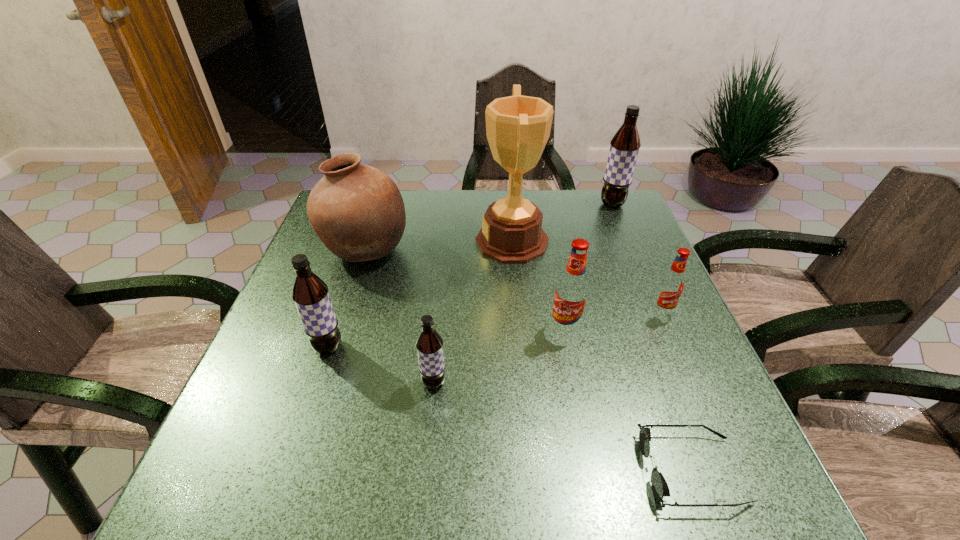
What are the coordinates of `the nearest brown root beer` in the screenshot? It's located at (429, 343).

Locate an element on the screen. This screenshot has height=540, width=960. the nearest object is located at coordinates (660, 488).

This screenshot has width=960, height=540. Find the location of `the shortest object`. the shortest object is located at coordinates click(x=660, y=488).

Locate an element on the screen. The image size is (960, 540). vacant space situated on the front-facing side of the award is located at coordinates (346, 241).

Identify the location of vacant space situated on the front-facing side of the award. (348, 241).

Locate an element on the screen. The height and width of the screenshot is (540, 960). free region located on the front-facing side of the award is located at coordinates (428, 241).

At what (x,y) coordinates should I click in order to perform the action: click on vacant position located on the left of the tallest root beer. Please return your answer as a coordinate pair (x, y). Image resolution: width=960 pixels, height=540 pixels. Looking at the image, I should click on (482, 204).

What are the coordinates of `vacant space located 0.080m on the right of the pottery` in the screenshot? It's located at (441, 249).

Find the location of a particular element. This screenshot has height=540, width=960. vacant space located 0.190m on the back of the third root beer from left to right is located at coordinates (553, 266).

Find the location of a particular element. vacant space located 0.390m on the right of the second farthest brown root beer is located at coordinates (528, 347).